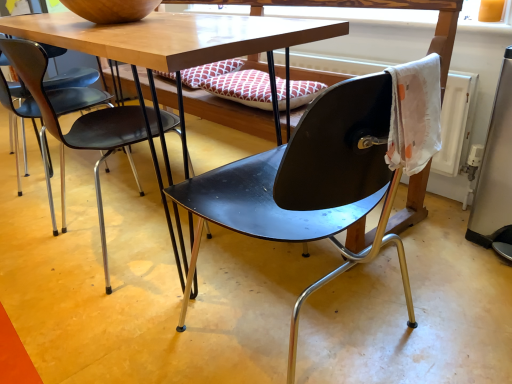
What do you see at coordinates (310, 185) in the screenshot? This screenshot has width=512, height=384. I see `matte black chair at center, which is counted as the first chair, starting from the right` at bounding box center [310, 185].

You are a GUI agent. You are given a task and a screenshot of the screen. Output one action in this format:
    pyautogui.click(x=<x>, y=<y>)
    Task: Click on the matte black chair at center, placed as the 2th chair when sorted from left to right
    
    Given the screenshot: What is the action you would take?
    pyautogui.click(x=310, y=185)

Identify the location of matte black chair at center, the 2th chair in the right-to-left sequence. (77, 124).

Describe the element at coordinates (77, 124) in the screenshot. I see `matte black chair at center, acting as the 1th chair starting from the left` at that location.

Find the location of a particular element. Image resolution: width=512 pixels, height=384 pixels. matte black chair at center, placed as the 2th chair when sorted from left to right is located at coordinates (310, 185).

Can you confirm if matte black chair at center, placed as the 2th chair when sorted from left to right, is positioned to the left of matte black chair at center, acting as the 1th chair starting from the left?

In fact, matte black chair at center, placed as the 2th chair when sorted from left to right, is to the right of matte black chair at center, acting as the 1th chair starting from the left.

Who is more distant, matte black chair at center, which is counted as the first chair, starting from the right, or matte black chair at center, the 2th chair in the right-to-left sequence?

matte black chair at center, the 2th chair in the right-to-left sequence, is behind.

Considering the positions of points (319, 226) and (96, 140), is point (319, 226) closer to camera compared to point (96, 140)?

Yes, it is in front of point (96, 140).

From the image's perspective, who appears lower, matte black chair at center, which is counted as the first chair, starting from the right, or matte black chair at center, acting as the 1th chair starting from the left?

matte black chair at center, which is counted as the first chair, starting from the right, is shown below in the image.

From a real-world perspective, is matte black chair at center, which is counted as the first chair, starting from the right, positioned over matte black chair at center, the 2th chair in the right-to-left sequence, based on gravity?

Correct, in the physical world, matte black chair at center, which is counted as the first chair, starting from the right, is higher than matte black chair at center, the 2th chair in the right-to-left sequence.

Is matte black chair at center, which is counted as the first chair, starting from the right, wider than matte black chair at center, acting as the 1th chair starting from the left?

Yes, matte black chair at center, which is counted as the first chair, starting from the right, is wider than matte black chair at center, acting as the 1th chair starting from the left.

Considering the sizes of objects matte black chair at center, placed as the 2th chair when sorted from left to right, and matte black chair at center, acting as the 1th chair starting from the left, in the image provided, who is shorter, matte black chair at center, placed as the 2th chair when sorted from left to right, or matte black chair at center, acting as the 1th chair starting from the left,?

matte black chair at center, acting as the 1th chair starting from the left, is shorter.

From the picture: Is matte black chair at center, placed as the 2th chair when sorted from left to right, bigger than matte black chair at center, the 2th chair in the right-to-left sequence?

Yes.

Would you say matte black chair at center, which is counted as the first chair, starting from the right, is inside or outside matte black chair at center, acting as the 1th chair starting from the left?

matte black chair at center, which is counted as the first chair, starting from the right, cannot be found inside matte black chair at center, acting as the 1th chair starting from the left.

Is matte black chair at center, which is counted as the first chair, starting from the right, far away from matte black chair at center, the 2th chair in the right-to-left sequence?

No, matte black chair at center, which is counted as the first chair, starting from the right, is in close proximity to matte black chair at center, the 2th chair in the right-to-left sequence.

Is matte black chair at center, which is counted as the first chair, starting from the right, aimed at matte black chair at center, acting as the 1th chair starting from the left?

Yes, matte black chair at center, which is counted as the first chair, starting from the right, is oriented towards matte black chair at center, acting as the 1th chair starting from the left.

What's the angular difference between matte black chair at center, placed as the 2th chair when sorted from left to right, and matte black chair at center, acting as the 1th chair starting from the left,'s facing directions?

The facing directions of matte black chair at center, placed as the 2th chair when sorted from left to right, and matte black chair at center, acting as the 1th chair starting from the left, are 90 degrees apart.

How far apart are matte black chair at center, which is counted as the first chair, starting from the right, and matte black chair at center, the 2th chair in the right-to-left sequence?

matte black chair at center, which is counted as the first chair, starting from the right, and matte black chair at center, the 2th chair in the right-to-left sequence, are 21.28 inches apart.

Identify the location of chair on the left of matte black chair at center, placed as the 2th chair when sorted from left to right. (77, 124).

Which object is positioned more to the right, matte black chair at center, the 2th chair in the right-to-left sequence, or matte black chair at center, placed as the 2th chair when sorted from left to right?

Positioned to the right is matte black chair at center, placed as the 2th chair when sorted from left to right.

Between matte black chair at center, the 2th chair in the right-to-left sequence, and matte black chair at center, placed as the 2th chair when sorted from left to right, which one is positioned in front?

Positioned in front is matte black chair at center, placed as the 2th chair when sorted from left to right.

Does point (0, 49) come closer to viewer compared to point (308, 134)?

No, it is not.

From the image's perspective, relative to matte black chair at center, which is counted as the first chair, starting from the right, is matte black chair at center, the 2th chair in the right-to-left sequence, above or below?

matte black chair at center, the 2th chair in the right-to-left sequence, is situated higher than matte black chair at center, which is counted as the first chair, starting from the right, in the image.

From a real-world perspective, between matte black chair at center, acting as the 1th chair starting from the left, and matte black chair at center, which is counted as the first chair, starting from the right, who is vertically higher?

In real-world perspective, matte black chair at center, which is counted as the first chair, starting from the right, is above.

Which object is wider, matte black chair at center, the 2th chair in the right-to-left sequence, or matte black chair at center, which is counted as the first chair, starting from the right?

Wider between the two is matte black chair at center, which is counted as the first chair, starting from the right.

Can you confirm if matte black chair at center, the 2th chair in the right-to-left sequence, is taller than matte black chair at center, which is counted as the first chair, starting from the right?

In fact, matte black chair at center, the 2th chair in the right-to-left sequence, may be shorter than matte black chair at center, which is counted as the first chair, starting from the right.

Which of these two, matte black chair at center, acting as the 1th chair starting from the left, or matte black chair at center, placed as the 2th chair when sorted from left to right, is bigger?

matte black chair at center, placed as the 2th chair when sorted from left to right, is bigger.

Is matte black chair at center, acting as the 1th chair starting from the left, inside the boundaries of matte black chair at center, which is counted as the first chair, starting from the right, or outside?

matte black chair at center, acting as the 1th chair starting from the left, is not inside matte black chair at center, which is counted as the first chair, starting from the right, it's outside.

Is matte black chair at center, the 2th chair in the right-to-left sequence, not near matte black chair at center, placed as the 2th chair when sorted from left to right?

No.

Does matte black chair at center, acting as the 1th chair starting from the left, turn towards matte black chair at center, placed as the 2th chair when sorted from left to right?

No.

What's the angular difference between matte black chair at center, the 2th chair in the right-to-left sequence, and matte black chair at center, placed as the 2th chair when sorted from left to right,'s facing directions?

matte black chair at center, the 2th chair in the right-to-left sequence, and matte black chair at center, placed as the 2th chair when sorted from left to right, are facing 90 degrees away from each other.

At what (x,y) coordinates should I click in order to perform the action: click on chair in front of the matte black chair at center, the 2th chair in the right-to-left sequence. Please return your answer as a coordinate pair (x, y). Image resolution: width=512 pixels, height=384 pixels. Looking at the image, I should click on (310, 185).

Locate an element on the screen. chair located on the left of matte black chair at center, placed as the 2th chair when sorted from left to right is located at coordinates (77, 124).

Where is `chair in front of the matte black chair at center, acting as the 1th chair starting from the left`? The image size is (512, 384). chair in front of the matte black chair at center, acting as the 1th chair starting from the left is located at coordinates coord(310,185).